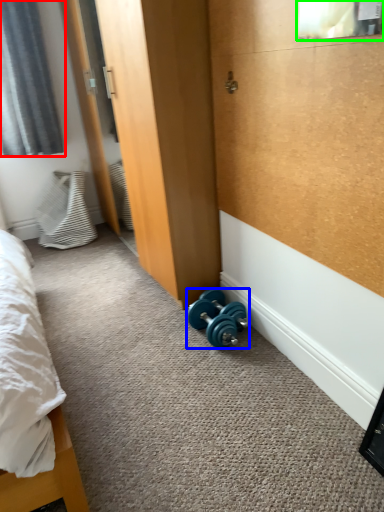
Question: Estimate the real-world distances between objects in this image. Which object is closer to curtain (highlighted by a red box), dumbbell (highlighted by a blue box) or window screen (highlighted by a green box)?

Choices:
 (A) dumbbell
 (B) window screen

Answer: (A)